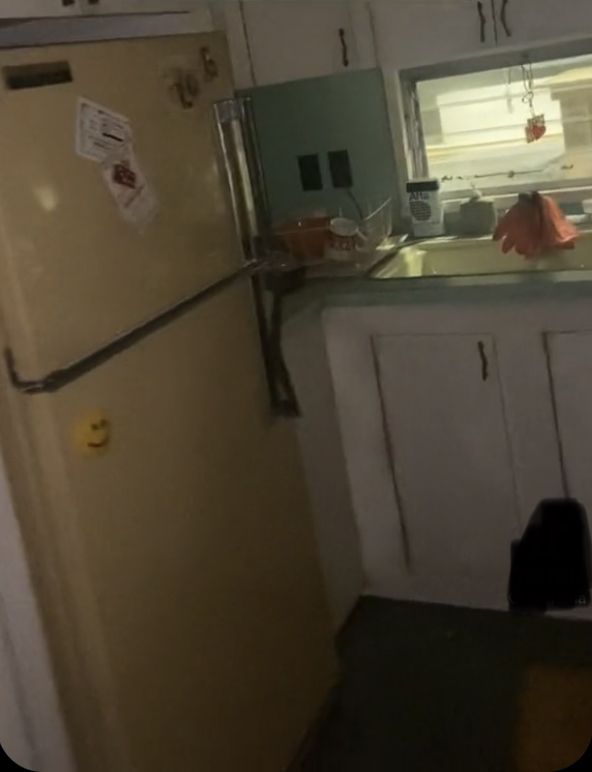
Identify the location of cupboards. The image size is (592, 772). (550, 32), (443, 428), (561, 367), (424, 12), (279, 63), (47, 2), (125, 7).